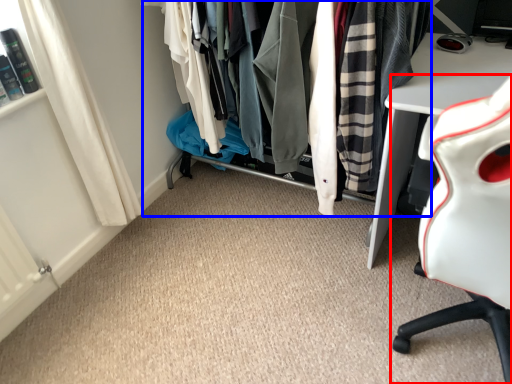
Question: Among these objects, which one is farthest to the camera, chair (highlighted by a red box) or closet (highlighted by a blue box)?

Choices:
 (A) chair
 (B) closet

Answer: (B)